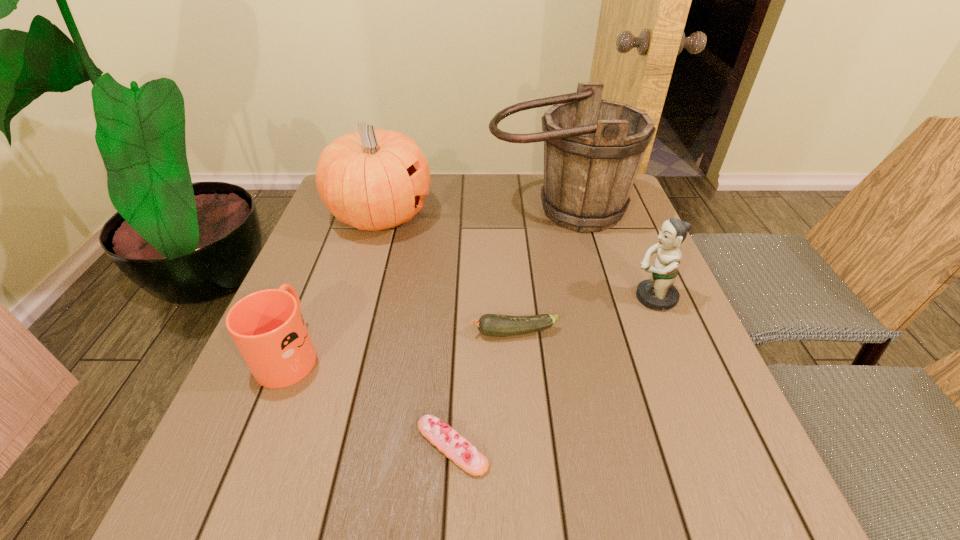
You are a GUI agent. You are given a task and a screenshot of the screen. Output one action in this format:
    pyautogui.click(x=<x>, y=<y>)
    Task: Click on the free location at the near edge
    
    Given the screenshot: What is the action you would take?
    pyautogui.click(x=386, y=469)

Find the location of a particular element. vacant space at the left edge is located at coordinates (354, 228).

Identify the location of blank space at the right edge of the desktop. (607, 241).

Locate an element on the screen. unoccupied area between the mug and the bucket is located at coordinates pyautogui.click(x=424, y=281).

Where is `free space between the bucket and the pumpkin`? This screenshot has height=540, width=960. free space between the bucket and the pumpkin is located at coordinates (469, 212).

This screenshot has height=540, width=960. What are the coordinates of `vacant space that's between the pumpkin and the figurine` in the screenshot? It's located at (516, 256).

The image size is (960, 540). I want to click on free point between the pumpkin and the nearest object, so click(417, 330).

At what (x,y) coordinates should I click in order to perform the action: click on vacant space that's between the second shortest object and the fourth nearest object. Please return your answer as a coordinate pair (x, y). The width and height of the screenshot is (960, 540). Looking at the image, I should click on (584, 315).

This screenshot has width=960, height=540. I want to click on vacant space in between the fourth shortest object and the second shortest object, so point(584,315).

Identify the location of free space between the fourth tallest object and the shortest object. The height and width of the screenshot is (540, 960). (371, 399).